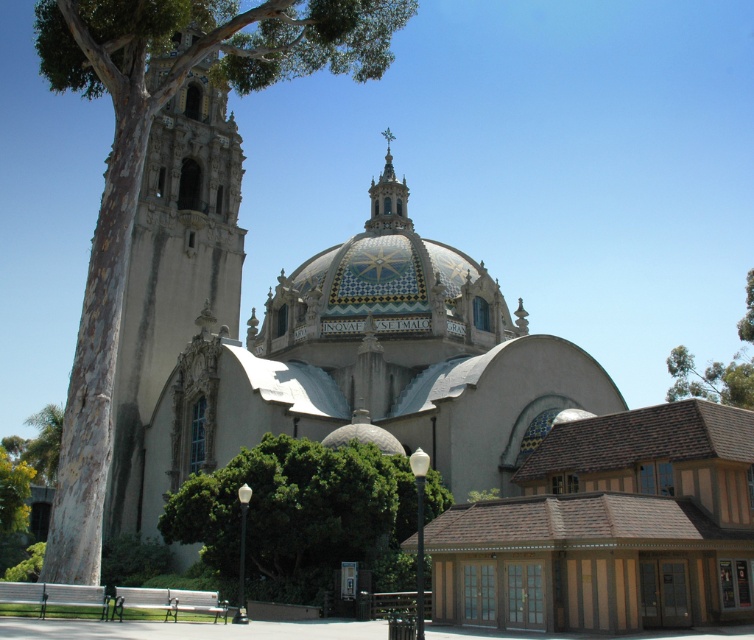
Is smooth bark tree at left bigger than gold mosaic spire at upper center?

Indeed, smooth bark tree at left has a larger size compared to gold mosaic spire at upper center.

Who is positioned more to the right, smooth bark tree at left or gold mosaic spire at upper center?

From the viewer's perspective, gold mosaic spire at upper center appears more on the right side.

Is point (363, 38) positioned after point (402, 196)?

No.

At what (x,y) coordinates should I click in order to perform the action: click on smooth bark tree at left. Please return your answer as a coordinate pair (x, y). This screenshot has width=754, height=640. Looking at the image, I should click on (141, 176).

The height and width of the screenshot is (640, 754). What are the coordinates of `green leafy tree at upper right` in the screenshot? It's located at (710, 378).

Locate an element on the screen. The image size is (754, 640). green leafy tree at upper right is located at coordinates (710, 378).

Can you confirm if brown wooden building at lower right is wider than gold mosaic spire at upper center?

Correct, the width of brown wooden building at lower right exceeds that of gold mosaic spire at upper center.

Is brown wooden building at lower right below gold mosaic spire at upper center?

Yes, brown wooden building at lower right is below gold mosaic spire at upper center.

Between point (434, 588) and point (369, 224), which one is positioned behind?

The point (369, 224) is more distant.

Identify the location of brown wooden building at lower right. This screenshot has height=640, width=754. (608, 528).